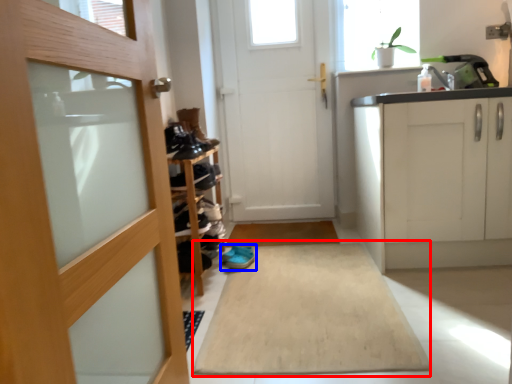
Question: Among these objects, which one is farthest to the camera, bath mat (highlighted by a red box) or footwear (highlighted by a blue box)?

Choices:
 (A) bath mat
 (B) footwear

Answer: (B)